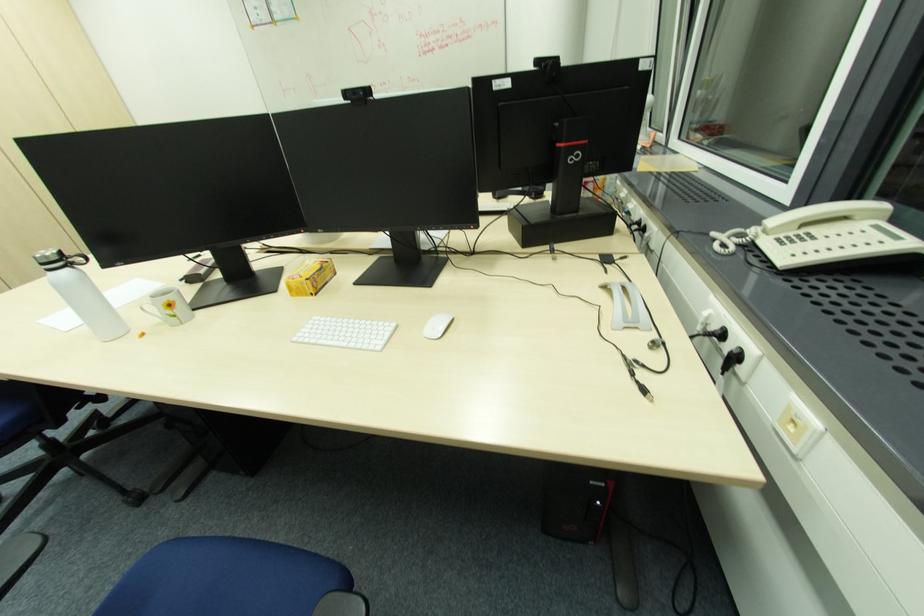
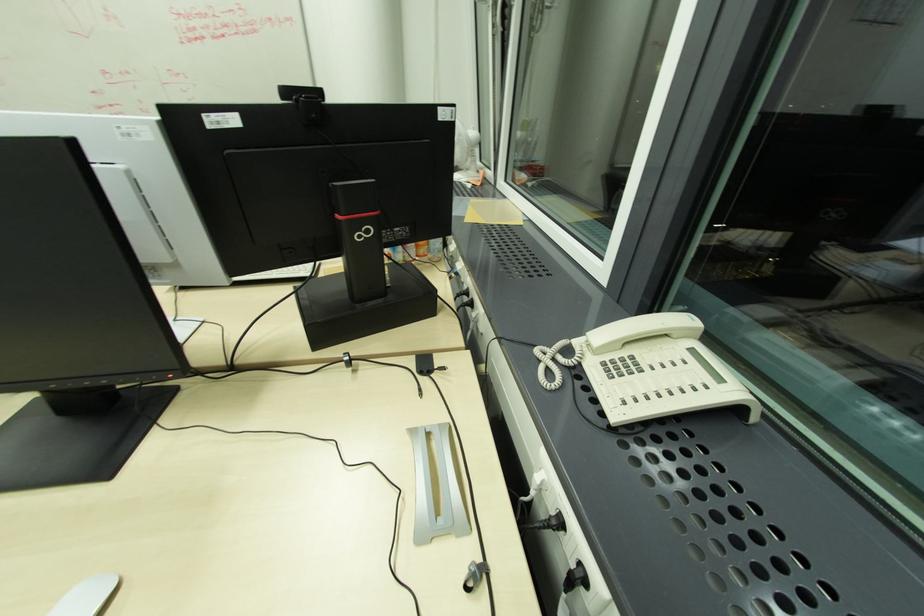
Question: The images are taken continuously from a first-person perspective. In which direction is your viewpoint rotating?

Choices:
 (A) Left
 (B) Right
 (C) Up
 (D) Down

Answer: (B)